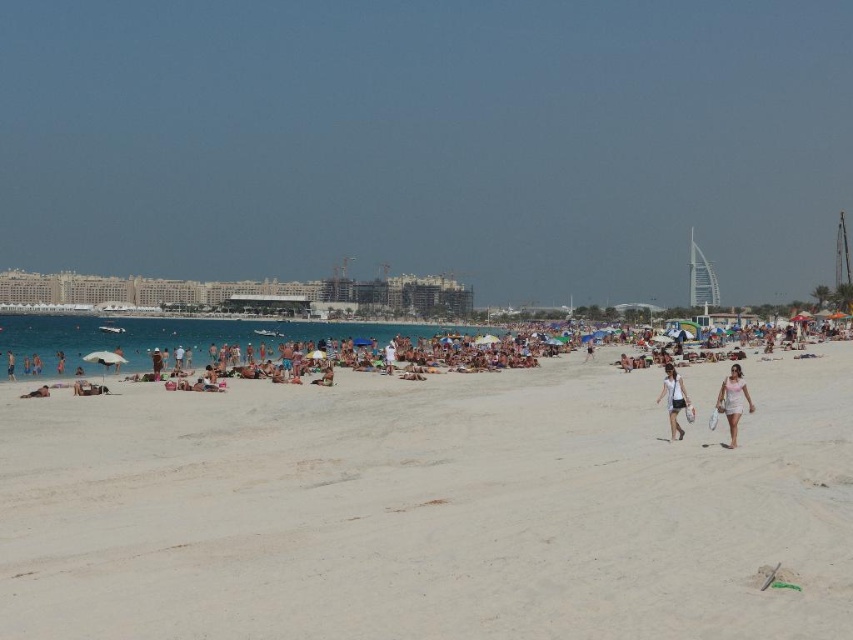
Question: Which point is closer to the camera?

Choices:
 (A) (733, 442)
 (B) (271, 531)

Answer: (B)

Question: Which object appears farthest from the camera in this image?

Choices:
 (A) white fabric shorts at center
 (B) tan skin person at lower left

Answer: (B)

Question: Can you confirm if white sandy beach at center is positioned above tan skin person at lower left?

Choices:
 (A) yes
 (B) no

Answer: (B)

Question: Is white fabric shorts at center to the right of tan skin person at lower left from the viewer's perspective?

Choices:
 (A) yes
 (B) no

Answer: (A)

Question: Can you confirm if white fabric shorts at center is positioned to the left of tan skin person at lower left?

Choices:
 (A) yes
 (B) no

Answer: (B)

Question: Which point is closer to the camera?

Choices:
 (A) pink fabric shorts at lower right
 (B) white sandy beach at center
 (C) white fabric shorts at center

Answer: (B)